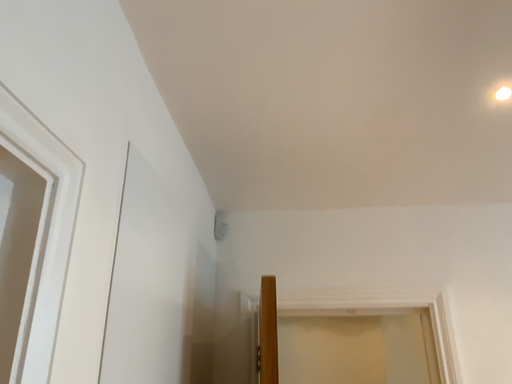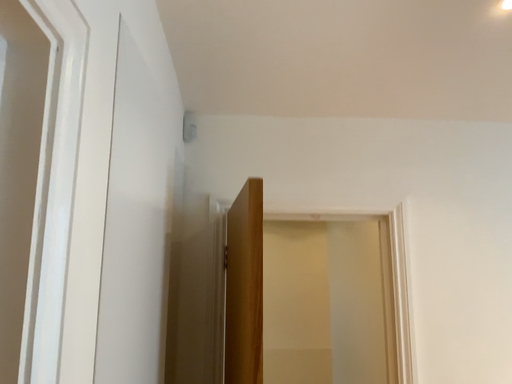
Question: How did the camera likely rotate when shooting the video?

Choices:
 (A) rotated right
 (B) rotated left

Answer: (A)